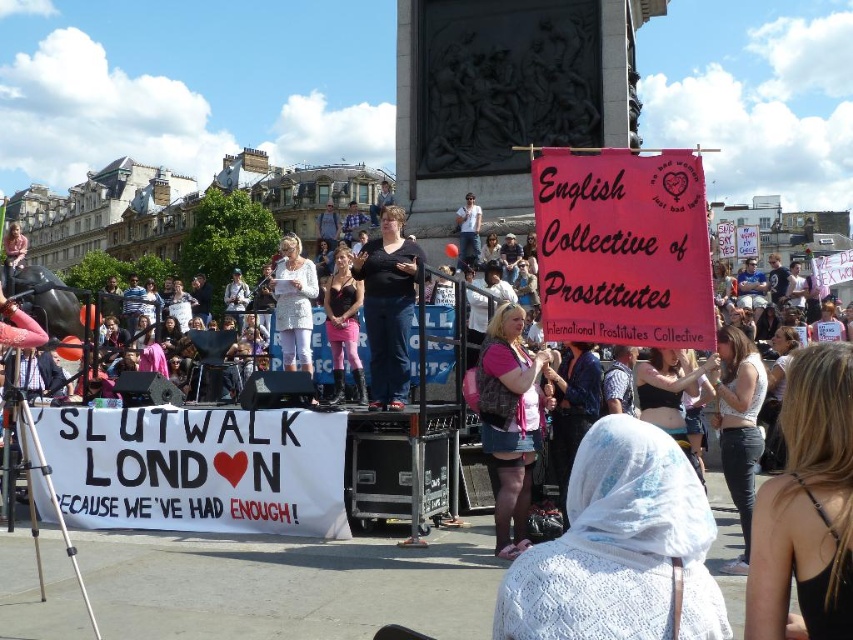
Does blonde hair at lower right have a larger size compared to pink fabric pants at center?

Correct, blonde hair at lower right is larger in size than pink fabric pants at center.

Can you confirm if blonde hair at lower right is thinner than pink fabric pants at center?

In fact, blonde hair at lower right might be wider than pink fabric pants at center.

Who is more forward, [828,344] or [352,308]?

Point [828,344]

Find the location of `blonde hair at lower right`. blonde hair at lower right is located at coordinates (807, 506).

Is white lace top at center to the left of pink fabric pants at center from the viewer's perspective?

Incorrect, white lace top at center is not on the left side of pink fabric pants at center.

Which of these two, white lace top at center or pink fabric pants at center, stands shorter?

pink fabric pants at center is shorter.

In order to click on white lace top at center in this screenshot , I will do `click(740, 424)`.

Is blonde hair at lower right smaller than white lace top at center?

No.

Is blonde hair at lower right closer to the viewer compared to white lace top at center?

Yes, blonde hair at lower right is closer to the viewer.

Who is more distant from viewer, (798,360) or (746,476)?

Positioned behind is point (746,476).

Locate an element on the screen. Image resolution: width=853 pixels, height=640 pixels. blonde hair at lower right is located at coordinates (807, 506).